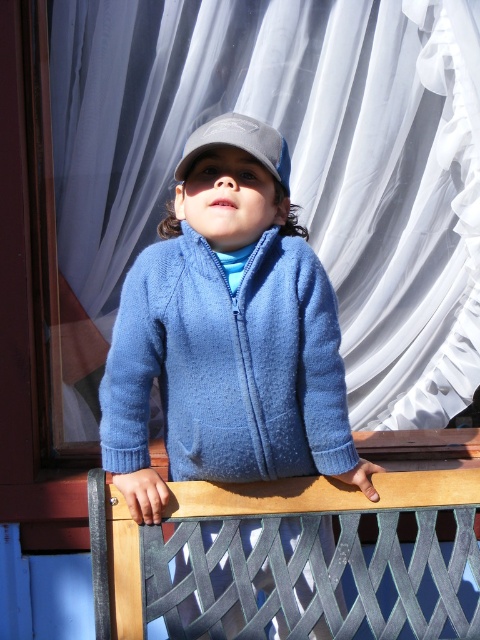
Does blue fleece jacket at center appear on the right side of blue fuzzy jacket at center?

Incorrect, blue fleece jacket at center is not on the right side of blue fuzzy jacket at center.

Is blue fleece jacket at center taller than blue fuzzy jacket at center?

Yes, blue fleece jacket at center is taller than blue fuzzy jacket at center.

Locate an element on the screen. blue fleece jacket at center is located at coordinates (228, 333).

Is point (122, 236) positioned behind point (181, 424)?

Yes.

Can you confirm if white sheer curtain at upper center is positioned to the right of blue fuzzy jacket at center?

Yes, white sheer curtain at upper center is to the right of blue fuzzy jacket at center.

What are the coordinates of `white sheer curtain at upper center` in the screenshot? It's located at (290, 173).

Is point (358, 237) less distant than point (215, 310)?

No, (358, 237) is further to viewer.

Is white sheer curtain at upper center wider than blue fleece jacket at center?

Yes.

Between point (392, 314) and point (339, 337), which one is positioned behind?

Positioned behind is point (392, 314).

Where is `white sheer curtain at upper center`? This screenshot has width=480, height=640. white sheer curtain at upper center is located at coordinates (290, 173).